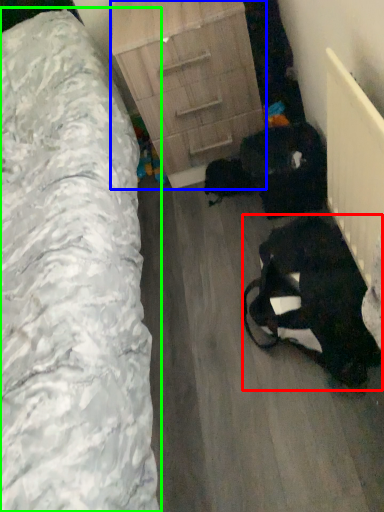
Question: Which object is positioned closest to animal (highlighted by a red box)? Select from chest of drawers (highlighted by a blue box) and furniture (highlighted by a green box).

Choices:
 (A) chest of drawers
 (B) furniture

Answer: (B)